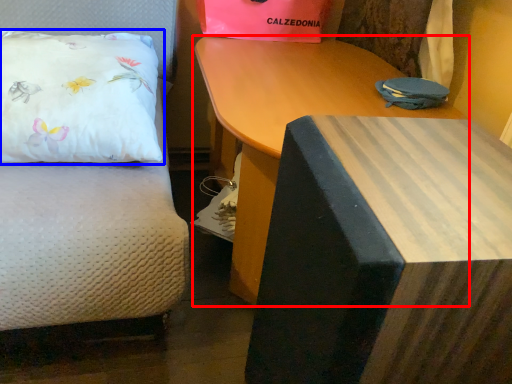
Question: Which object is closer to the camera taking this photo, table (highlighted by a red box) or pillow (highlighted by a blue box)?

Choices:
 (A) table
 (B) pillow

Answer: (A)